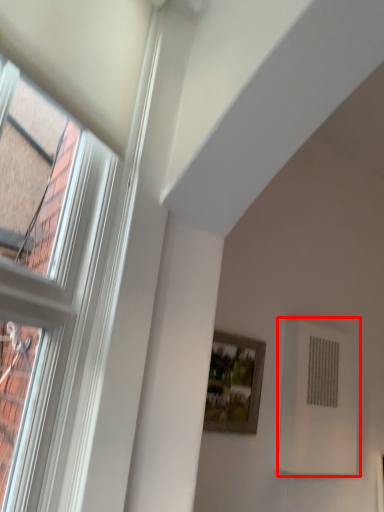
Question: Considering the relative positions of air conditioning (annotated by the red box) and picture frame in the image provided, where is air conditioning (annotated by the red box) located with respect to the staircase?

Choices:
 (A) right
 (B) left

Answer: (A)